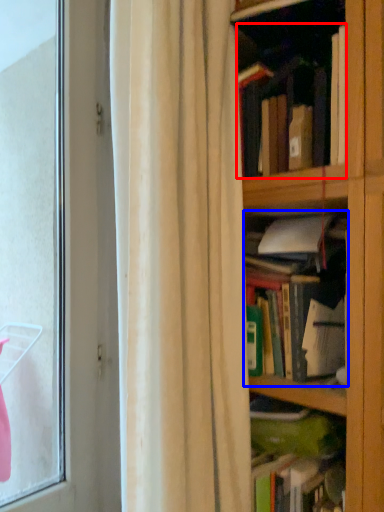
Question: Which of the following is the farthest to the observer, book (highlighted by a red box) or book (highlighted by a blue box)?

Choices:
 (A) book
 (B) book

Answer: (B)